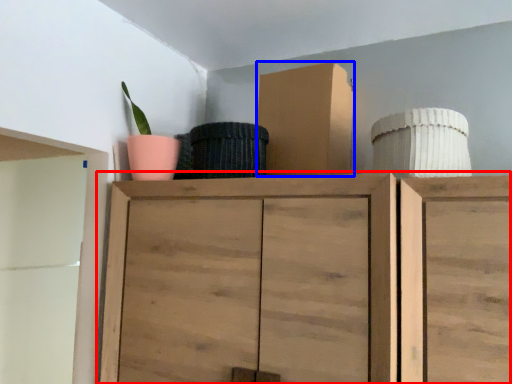
Question: Which object is closer to the camera taking this photo, cupboard (highlighted by a red box) or cardboard box (highlighted by a blue box)?

Choices:
 (A) cupboard
 (B) cardboard box

Answer: (A)